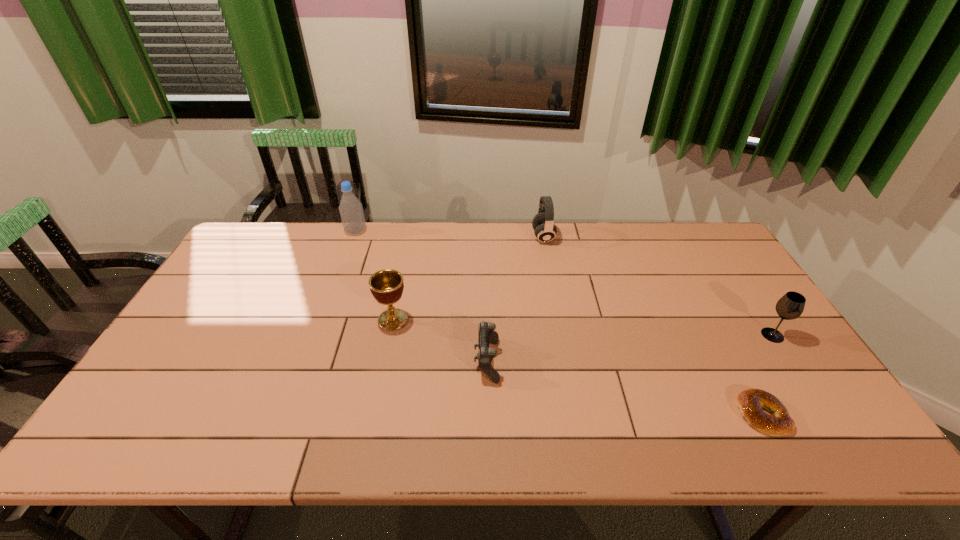
Identify the location of free space located 0.360m on the ear cups of the headset. This screenshot has width=960, height=540. (430, 237).

Where is `vacant space situated on the ear cups of the headset`? vacant space situated on the ear cups of the headset is located at coordinates (481, 237).

The width and height of the screenshot is (960, 540). I want to click on vacant space located 0.380m on the ear cups of the headset, so click(425, 237).

The width and height of the screenshot is (960, 540). In order to click on blank area located 0.300m on the left of the fifth object from right to left in this screenshot , I will do `click(272, 320)`.

This screenshot has height=540, width=960. I want to click on blank space located 0.180m on the back of the wineglass, so click(739, 285).

Locate an element on the screen. The image size is (960, 540). vacant point located on the surface of the control with buttons is located at coordinates (417, 361).

Image resolution: width=960 pixels, height=540 pixels. Find the location of `vacant space located on the surface of the control with buttons`. vacant space located on the surface of the control with buttons is located at coordinates (344, 361).

Locate an element on the screen. The height and width of the screenshot is (540, 960). vacant space located 0.330m on the surface of the control with buttons is located at coordinates (348, 361).

At what (x,y) coordinates should I click in order to perform the action: click on vacant space located on the left of the nearest object. Please return your answer as a coordinate pair (x, y). The image size is (960, 540). Looking at the image, I should click on (696, 415).

The image size is (960, 540). Identify the location of bottle that is positioned at the far edge. (351, 211).